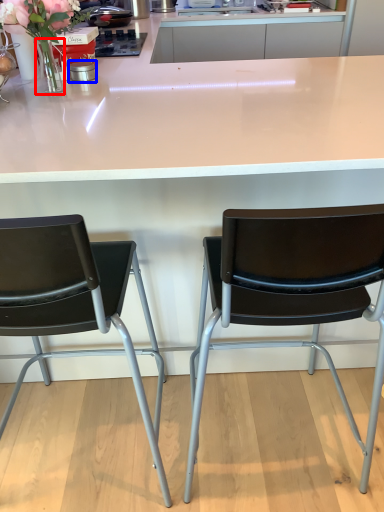
Question: Among these objects, which one is farthest to the camera, vase (highlighted by a red box) or appliance (highlighted by a blue box)?

Choices:
 (A) vase
 (B) appliance

Answer: (B)